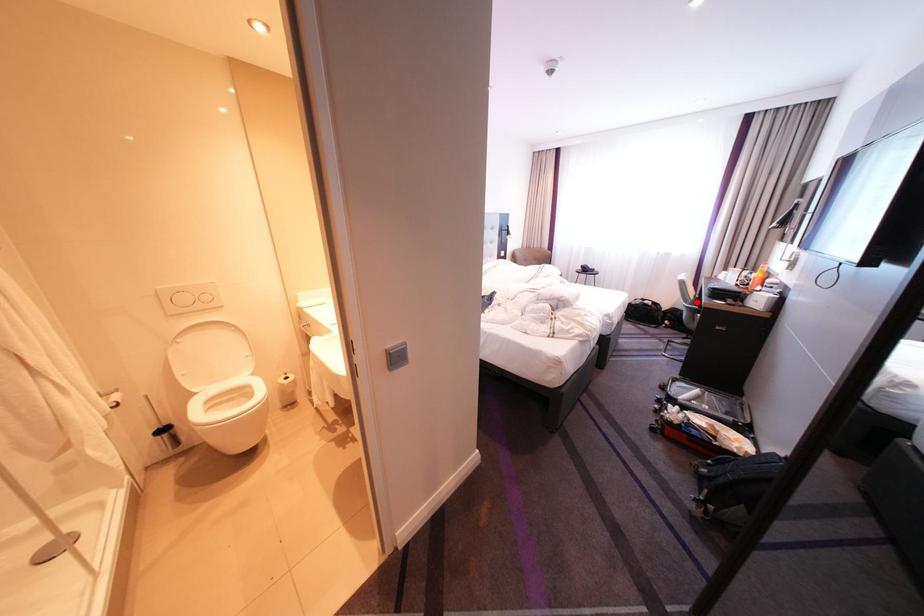
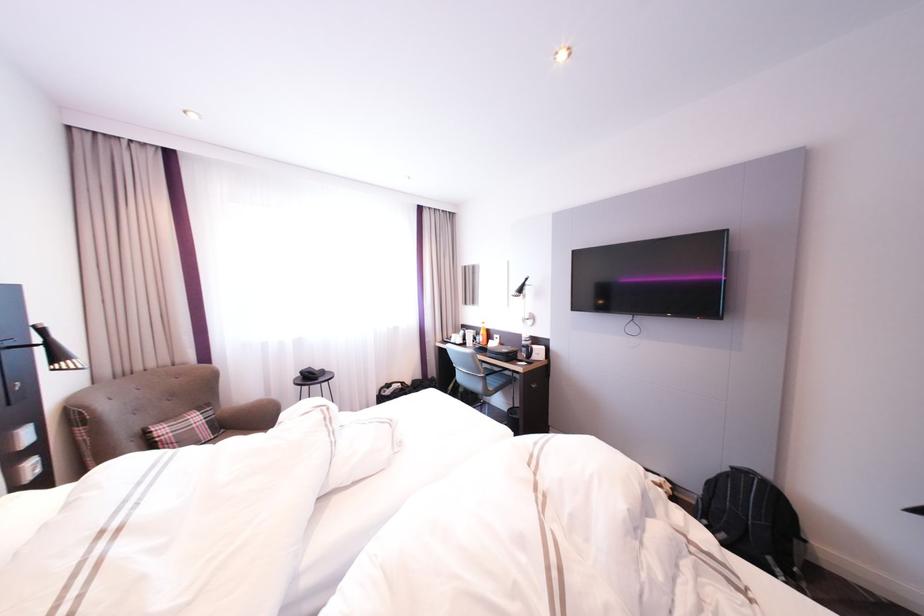
Question: I am providing you with two images of the same scene from different viewpoints. A red point is marked on the first image. Can you still see the location of the red point in image 2?

Choices:
 (A) Yes
 (B) No

Answer: (A)